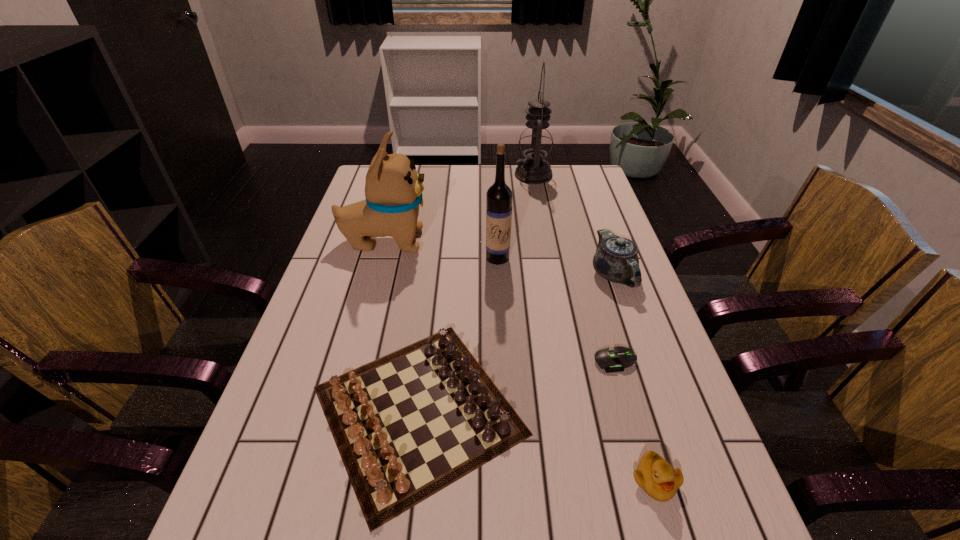
At what (x,y) coordinates should I click in order to perform the action: click on the farthest object. Please return your answer as a coordinate pair (x, y). Image resolution: width=960 pixels, height=540 pixels. Looking at the image, I should click on (536, 140).

Where is `wine bottle`? wine bottle is located at coordinates (499, 196).

You are a GUI agent. You are given a task and a screenshot of the screen. Output one action in this format:
    pyautogui.click(x=<x>, y=<y>)
    Task: Click on the puppy
    
    Given the screenshot: What is the action you would take?
    pyautogui.click(x=393, y=189)

This screenshot has width=960, height=540. Identify the location of the fourth shortest object. (616, 259).

The height and width of the screenshot is (540, 960). Find the location of `chessboard`. chessboard is located at coordinates (407, 425).

Image resolution: width=960 pixels, height=540 pixels. Identify the location of the sixth tallest object. (654, 475).

This screenshot has height=540, width=960. In order to click on computer mouse in this screenshot , I will do `click(611, 360)`.

Locate an element on the screen. The width and height of the screenshot is (960, 540). free point located 0.180m on the front of the oil lamp is located at coordinates (540, 213).

This screenshot has height=540, width=960. In order to click on vacant space situated on the label of the wine bottle in this screenshot , I will do `click(502, 342)`.

Identify the location of vacant space located 0.260m on the face of the puppy. The width and height of the screenshot is (960, 540). click(515, 241).